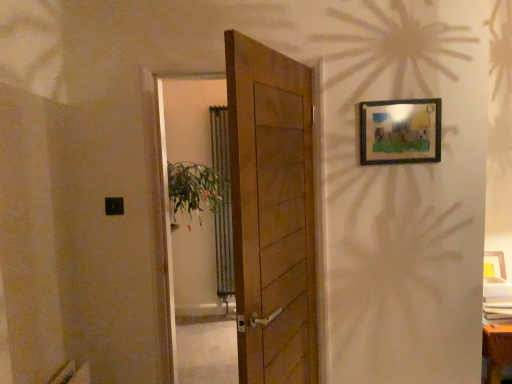
Question: Considering their positions, is wooden door at center located in front of or behind wooden door at center?

Choices:
 (A) front
 (B) behind

Answer: (A)

Question: Considering the positions of wooden door at center and wooden door at center in the image, is wooden door at center wider or thinner than wooden door at center?

Choices:
 (A) wide
 (B) thin

Answer: (B)

Question: Which is farther from the wooden door at center?

Choices:
 (A) wooden door at center
 (B) green leafy plant at center
 (C) wooden picture frame at upper right

Answer: (A)

Question: Which object is positioned farthest from the green leafy plant at center?

Choices:
 (A) wooden door at center
 (B) wooden door at center
 (C) wooden picture frame at upper right

Answer: (A)